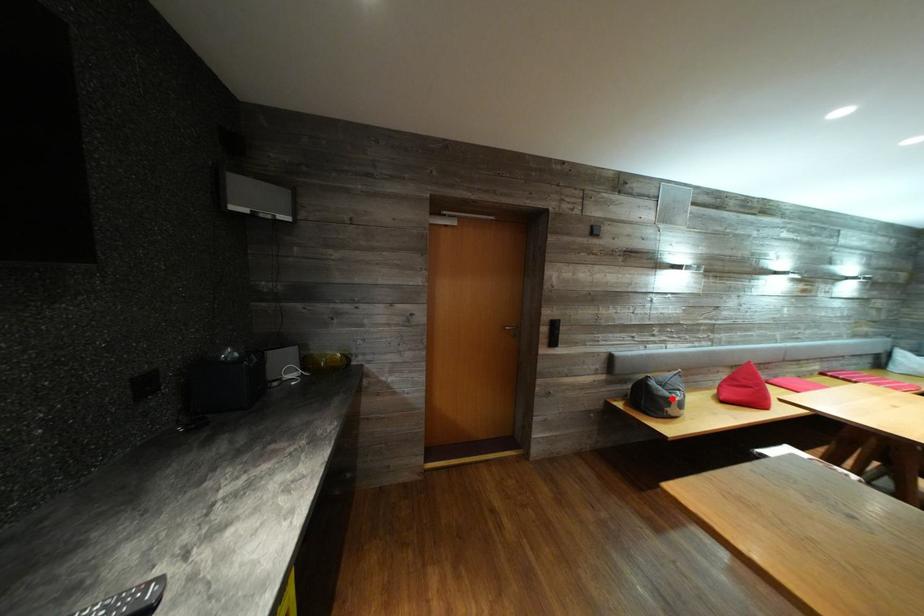
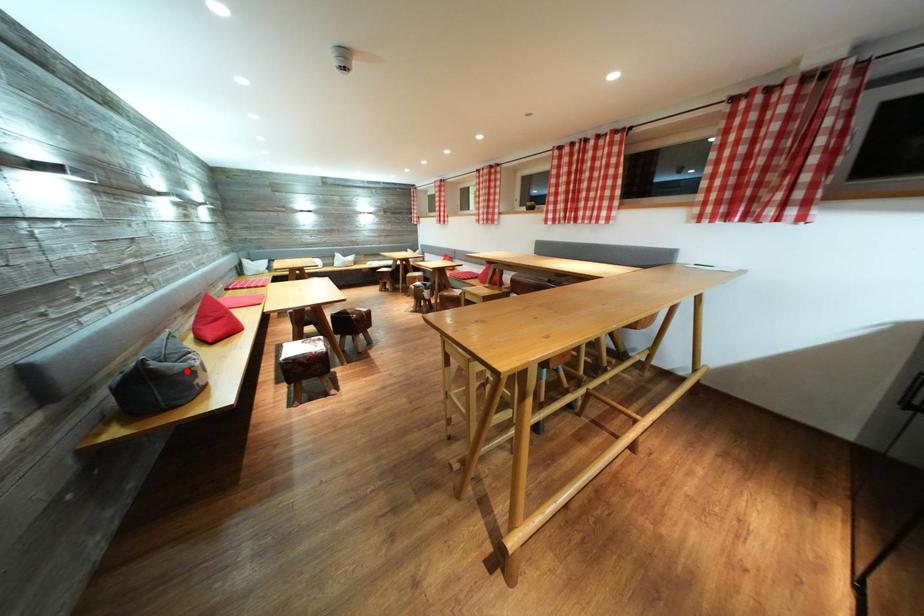
I am providing you with two images of the same scene from different viewpoints. A red point is marked on the first image and another point is marked on the second image. Does the point marked in image1 correspond to the same location as the one in image2?

Yes